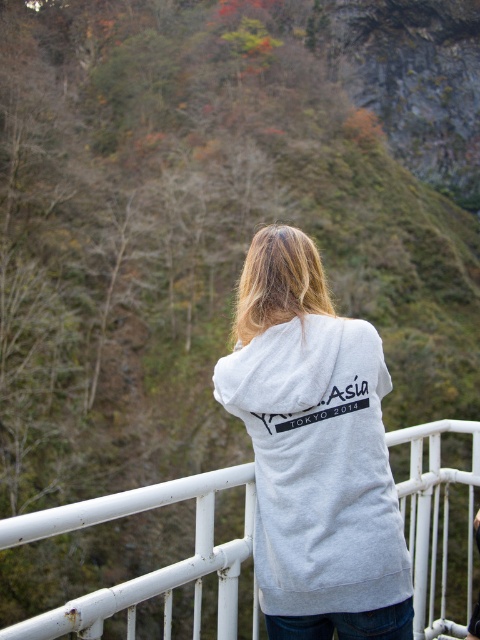
Question: Which point appears closest to the camera in this image?

Choices:
 (A) coord(298,410)
 (B) coord(156,499)

Answer: (B)

Question: Does gray cotton hoodie at center have a larger size compared to white metal railing at center?

Choices:
 (A) no
 (B) yes

Answer: (A)

Question: Which object is closer to the camera taking this photo?

Choices:
 (A) white metal railing at center
 (B) gray cotton hoodie at center

Answer: (A)

Question: Considering the relative positions of gray cotton hoodie at center and white metal railing at center in the image provided, where is gray cotton hoodie at center located with respect to white metal railing at center?

Choices:
 (A) below
 (B) above

Answer: (B)

Question: Is the position of gray cotton hoodie at center less distant than that of white metal railing at center?

Choices:
 (A) no
 (B) yes

Answer: (A)